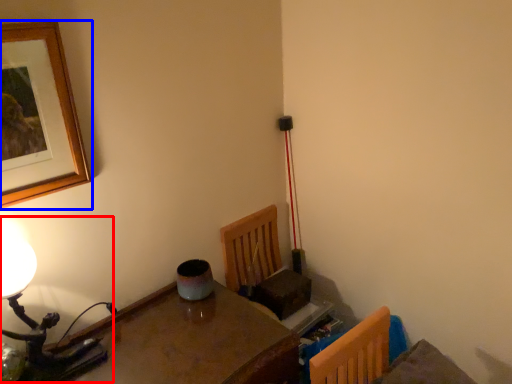
Question: Which object appears closest to the camera in this image, table lamp (highlighted by a red box) or picture frame (highlighted by a blue box)?

Choices:
 (A) table lamp
 (B) picture frame

Answer: (B)